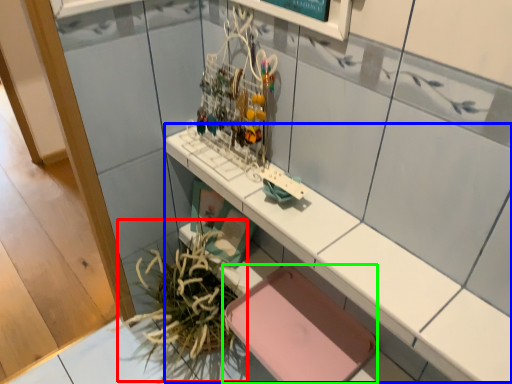
Question: Based on their relative distances, which object is nearer to plant (highlighted by a red box)? Choose from counter (highlighted by a blue box) and chair (highlighted by a green box).

Choices:
 (A) counter
 (B) chair

Answer: (B)